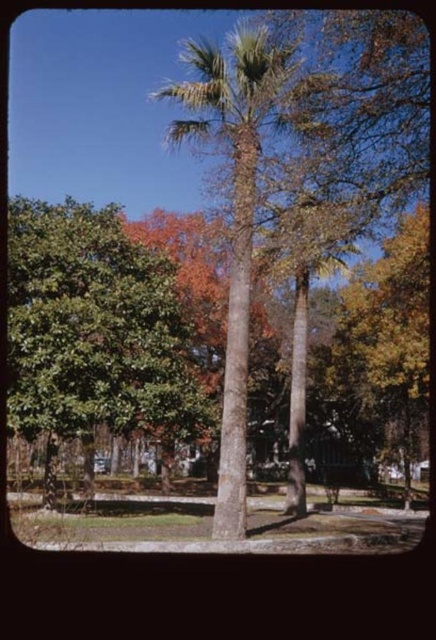
Question: Is green leafy tree at left further to camera compared to smooth brown palm tree at center?

Choices:
 (A) no
 (B) yes

Answer: (B)

Question: From the image, what is the correct spatial relationship of green leafy tree at left in relation to smooth brown palm tree at center?

Choices:
 (A) right
 (B) left

Answer: (B)

Question: Does green leafy tree at left have a greater width compared to smooth brown palm tree at center?

Choices:
 (A) yes
 (B) no

Answer: (B)

Question: Which object appears farthest from the camera in this image?

Choices:
 (A) green leafy tree at left
 (B) smooth brown palm tree at center

Answer: (A)

Question: Which of the following is the farthest from the observer?

Choices:
 (A) (258, 28)
 (B) (78, 419)

Answer: (B)